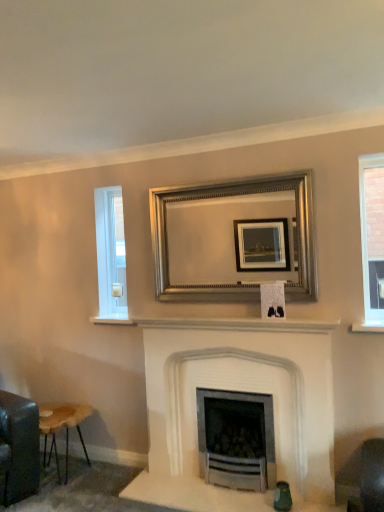
In order to click on free spot above wooden stool at lower left (from a real-world perspective) in this screenshot , I will do `click(59, 412)`.